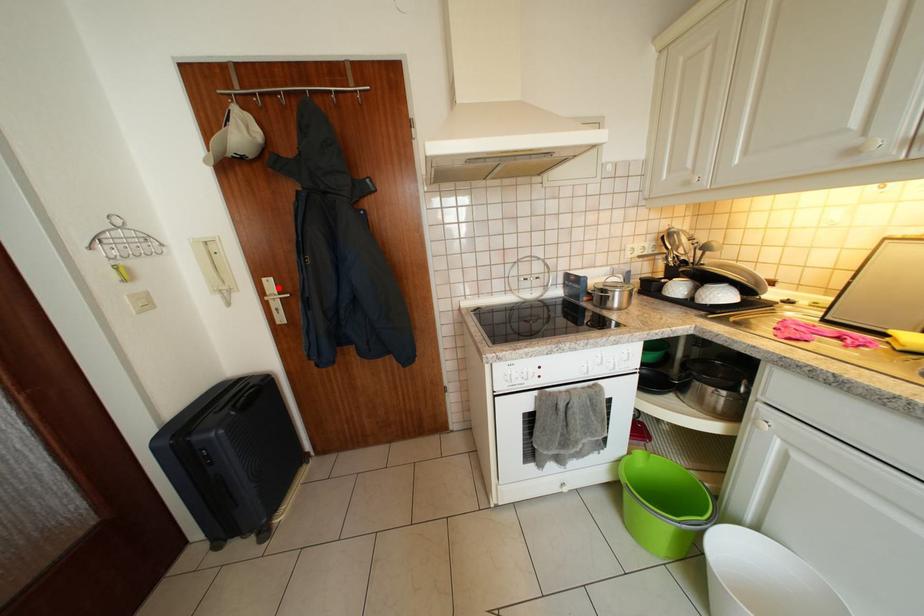
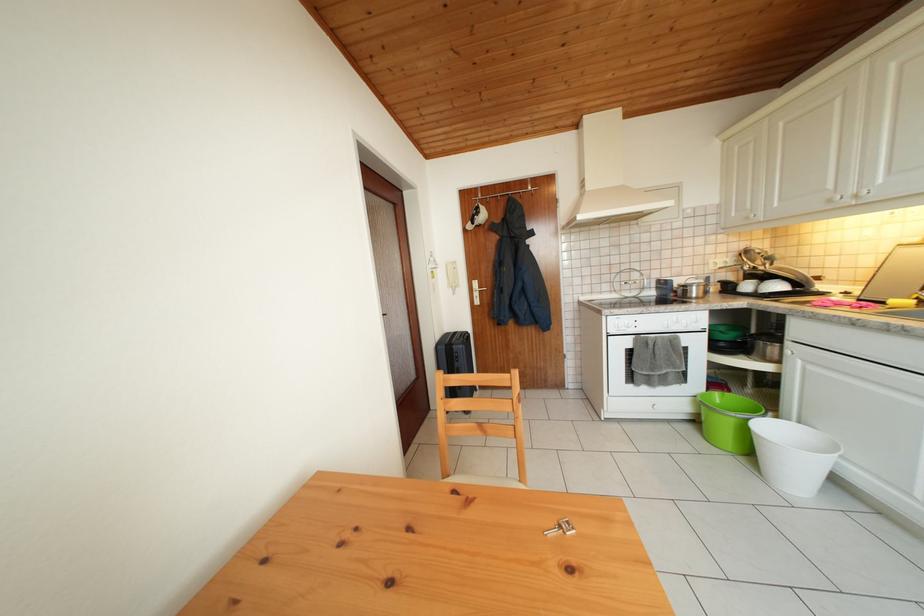
In the second image, find the point that corresponds to the highlighted location in the first image.

(483, 288)